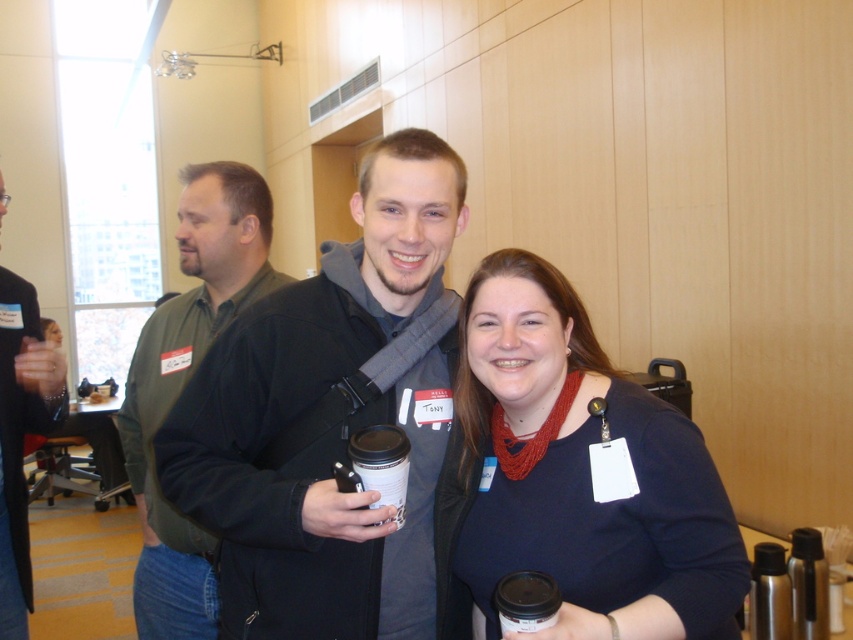
You are standing at the camera position and want to hand a document to Tony, who is wearing the black matte jacket at left. Since you can only reach 5 feet, can you hand him the document without moving?

The black matte jacket at left is 6.01 feet away from the camera, which is beyond your 5 feet reach. You cannot hand Tony the document without moving closer.